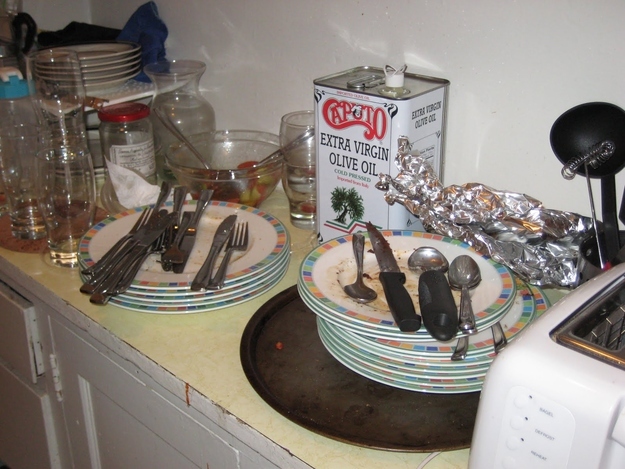
Identify the location of jar. This screenshot has height=469, width=625. (144, 129).